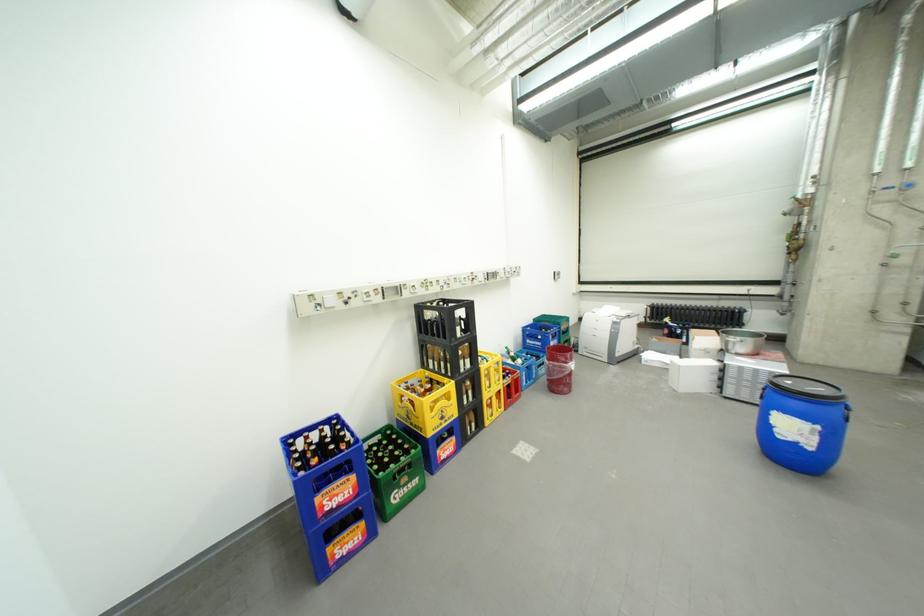
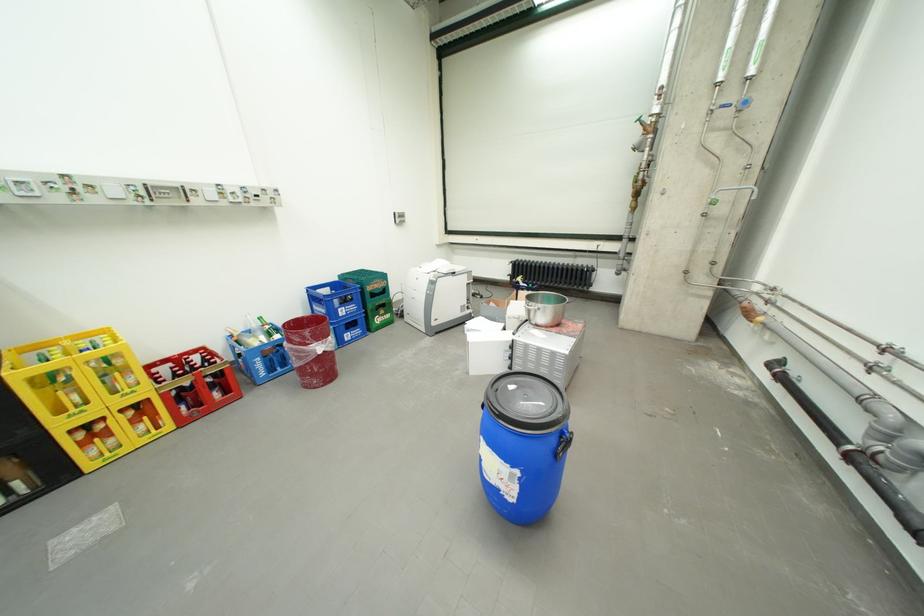
Locate, in the second image, the point that corresponds to (x=493, y=368) in the first image.

(30, 374)